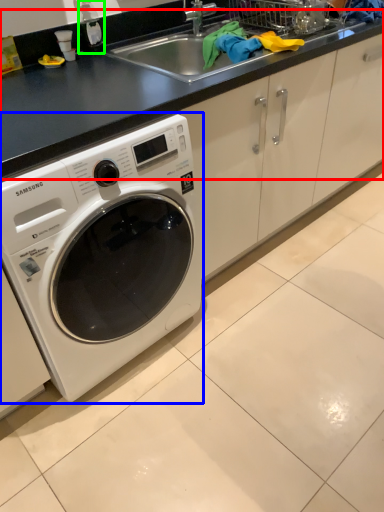
Question: Which object is positioned closest to counter top (highlighted by a red box)? Select from washing machine (highlighted by a blue box) and bottle (highlighted by a green box).

Choices:
 (A) washing machine
 (B) bottle

Answer: (A)